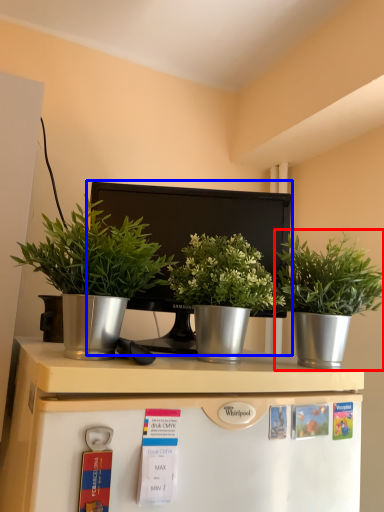
Question: Which object appears closest to the camera in this image, houseplant (highlighted by a red box) or appliance (highlighted by a blue box)?

Choices:
 (A) houseplant
 (B) appliance

Answer: (A)